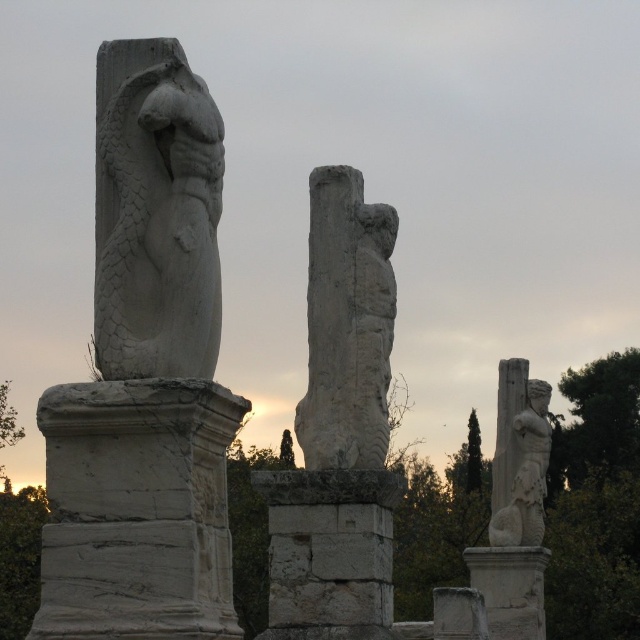
Which is in front, point (83, 568) or point (518, 564)?

Point (83, 568) is more forward.

In the scene shown: Is white stone pillar at left shorter than white stone pillar at lower right?

No.

Where is `white stone pillar at left`? The height and width of the screenshot is (640, 640). white stone pillar at left is located at coordinates (136, 509).

Does white stone dragon at center have a lesser width compared to white stone pillar at lower right?

Correct, white stone dragon at center's width is less than white stone pillar at lower right's.

What are the coordinates of `white stone dragon at center` in the screenshot? It's located at (156, 214).

In order to click on white stone dragon at center in this screenshot , I will do `click(156, 214)`.

Identify the location of white stone dragon at center. (156, 214).

Is white stone dragon at center closer to camera compared to white stone pillar at center?

Yes.

Does white stone dragon at center appear under white stone pillar at center?

A: No.

Find the location of `white stone dragon at center`. white stone dragon at center is located at coordinates (156, 214).